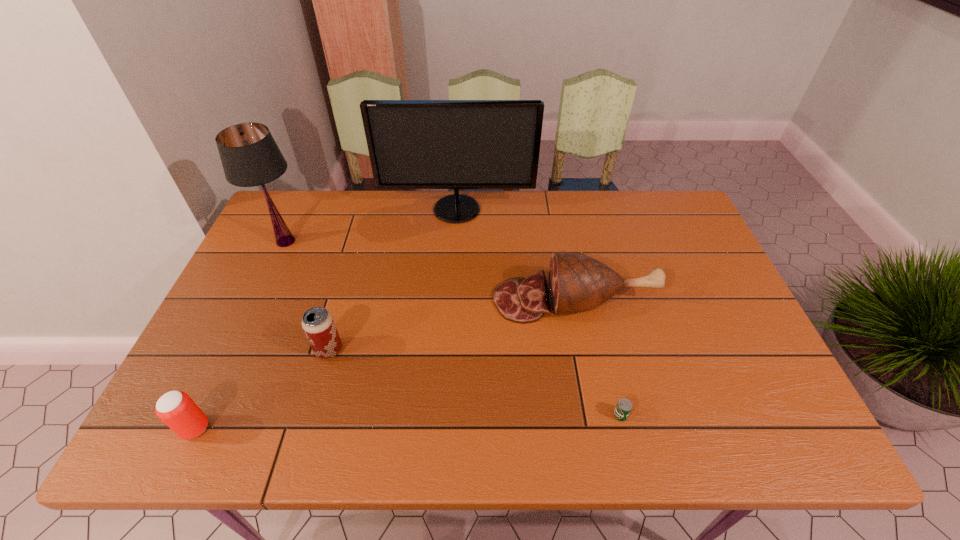
Where is `vacant area situated 0.070m at the sliced end of the fourth nearest object`? Image resolution: width=960 pixels, height=540 pixels. vacant area situated 0.070m at the sliced end of the fourth nearest object is located at coordinates (468, 300).

At what (x,y) coordinates should I click in order to perform the action: click on vacant region located at the sliced end of the fourth nearest object. Please return your answer as a coordinate pair (x, y). Image resolution: width=960 pixels, height=540 pixels. Looking at the image, I should click on (348, 300).

Where is `free space located at the sliced end of the fourth nearest object`? Image resolution: width=960 pixels, height=540 pixels. free space located at the sliced end of the fourth nearest object is located at coordinates (422, 300).

The width and height of the screenshot is (960, 540). I want to click on vacant space located on the back of the farthest beer can, so click(358, 247).

Where is `vacant space located on the right of the leftmost beer can`? The height and width of the screenshot is (540, 960). vacant space located on the right of the leftmost beer can is located at coordinates (331, 428).

The image size is (960, 540). Identify the location of vacant region located 0.350m on the left of the shortest object. pyautogui.click(x=452, y=415).

I want to click on computer monitor that is at the far edge, so click(413, 144).

In order to click on lampshade located in the far edge section of the desktop in this screenshot , I will do `click(250, 157)`.

At what (x,y) coordinates should I click in order to perform the action: click on lampshade positioned at the left edge. Please return your answer as a coordinate pair (x, y). Looking at the image, I should click on (250, 157).

Where is `beer can present at the left edge`? The height and width of the screenshot is (540, 960). beer can present at the left edge is located at coordinates (176, 409).